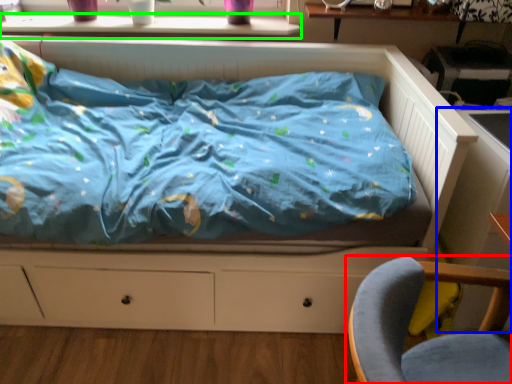
Question: Considering the real-world distances, which object is closest to chair (highlighted by a red box)? table (highlighted by a blue box) or window sill (highlighted by a green box).

Choices:
 (A) table
 (B) window sill

Answer: (A)